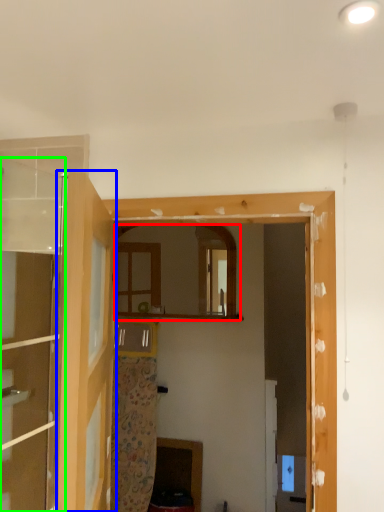
Question: Estimate the real-world distances between objects in this image. Which object is closer to mirror (highlighted by a red box), door (highlighted by a blue box) or door (highlighted by a green box)?

Choices:
 (A) door
 (B) door

Answer: (B)